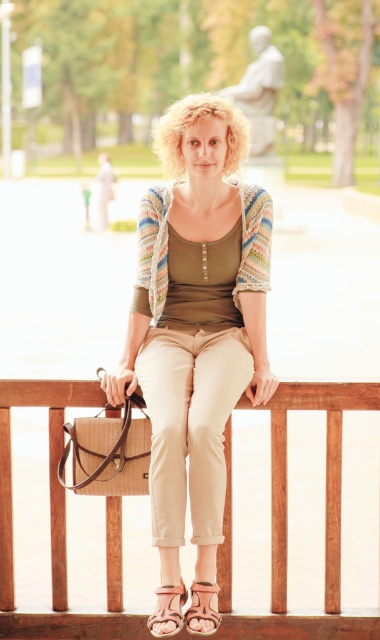
Question: Is wooden fence at lower center closer to camera compared to leather sandal at lower center?

Choices:
 (A) no
 (B) yes

Answer: (A)

Question: Which point is farther to the camera?

Choices:
 (A) pyautogui.click(x=172, y=589)
 (B) pyautogui.click(x=107, y=609)
 (C) pyautogui.click(x=145, y=435)
 (D) pyautogui.click(x=156, y=298)

Answer: (D)

Question: Which point appears closest to the camera in this image?

Choices:
 (A) (193, 582)
 (B) (188, 365)
 (C) (93, 470)
 (D) (332, 506)

Answer: (A)

Question: Does matte beige pants at center appear over leather sandal at lower center?

Choices:
 (A) no
 (B) yes

Answer: (B)

Question: Which of these objects is positioned closest to the leather sandals at lower center?

Choices:
 (A) matte beige pants at center
 (B) woven straw bag at lower left
 (C) leather sandal at lower center

Answer: (C)

Question: Does matte beige pants at center have a greater width compared to leather sandals at lower center?

Choices:
 (A) no
 (B) yes

Answer: (B)